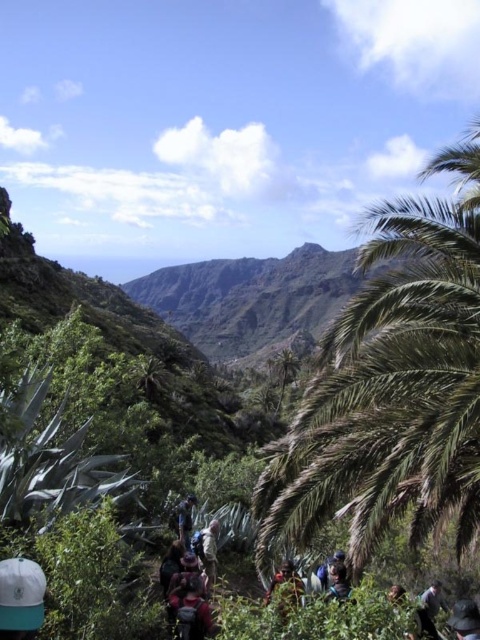
You are a hiker standing at the starting point of the trail. You notice two points marked on your map corresponding to coordinates point [11,576] and point [468,628]. Which point is closer to your current position?

Point [11,576] is in front of point [468,628], so the point closer to your current position is point [11,576].